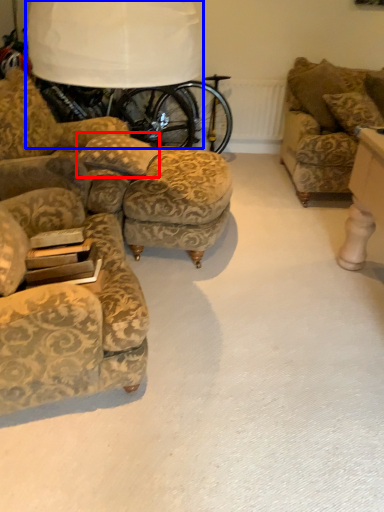
Question: Which of the following is the closest to the observer, pillow (highlighted by a red box) or table lamp (highlighted by a blue box)?

Choices:
 (A) pillow
 (B) table lamp

Answer: (A)